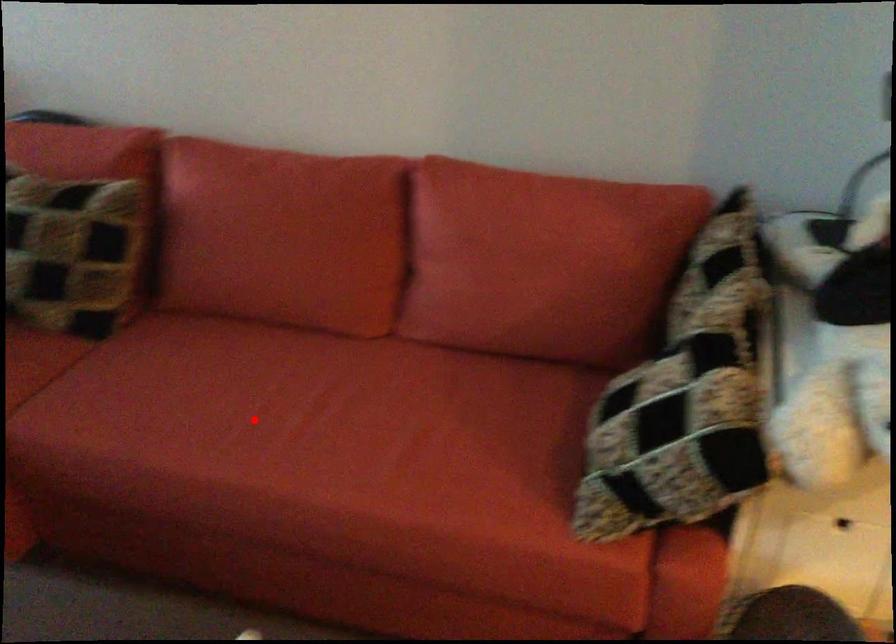
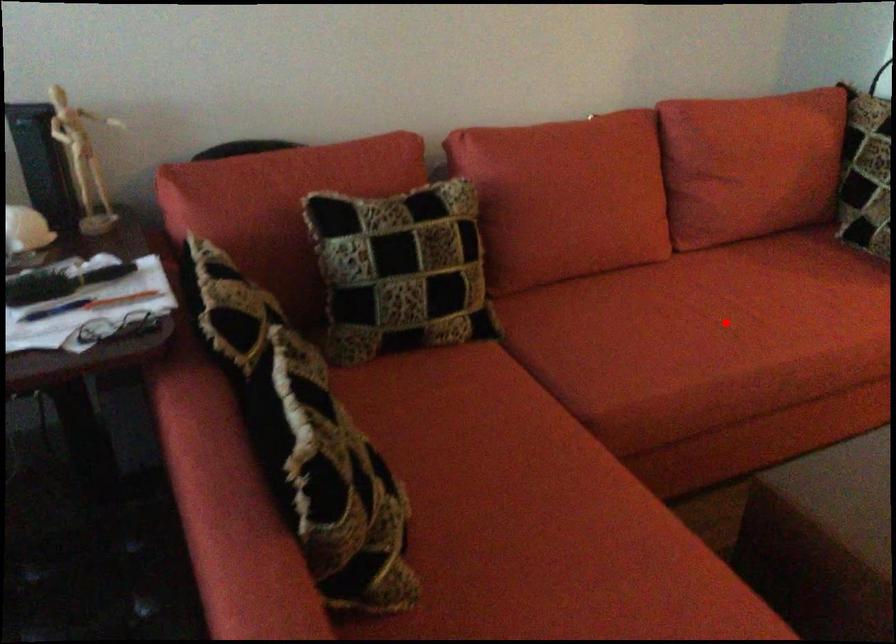
I am providing you with two images of the same scene from different viewpoints. A red point is marked on the first image and another point is marked on the second image. Is the marked point in image1 the same physical position as the marked point in image2?

Yes